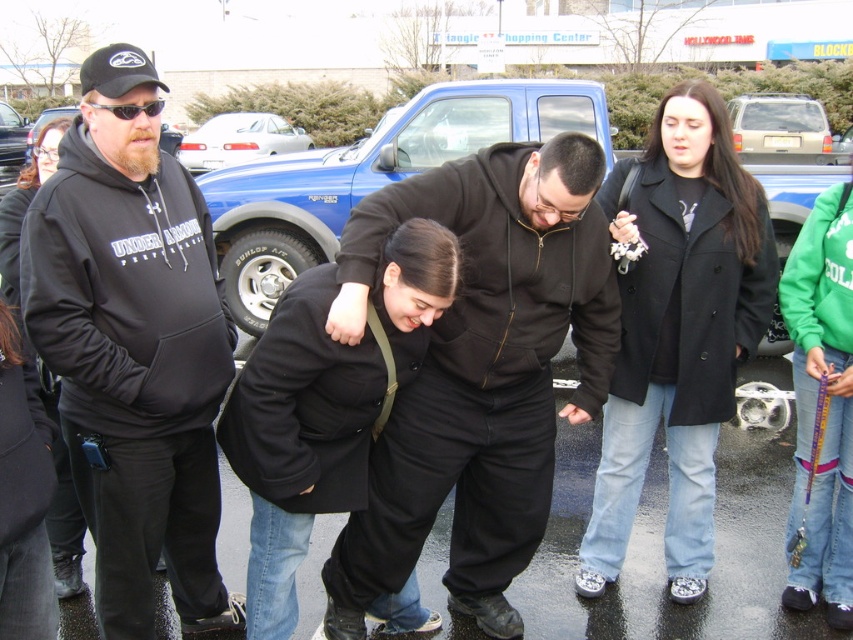
Question: Which is farther from the black matte coat at center?

Choices:
 (A) black matte hoodie at center
 (B) black wool coat at center
 (C) brushed metal truck at left
 (D) matte black coat at center

Answer: (C)

Question: Can you confirm if black hoodie at left is positioned above brushed metal truck at left?

Choices:
 (A) no
 (B) yes

Answer: (A)

Question: Among these objects, which one is farthest from the camera?

Choices:
 (A) black matte hoodie at center
 (B) brushed metal truck at left
 (C) black wool coat at center

Answer: (B)

Question: Is green fleece sweatshirt at lower right smaller than brushed metal truck at left?

Choices:
 (A) no
 (B) yes

Answer: (B)

Question: Estimate the real-world distances between objects in this image. Which object is farther from the satin silver sedan at upper left?

Choices:
 (A) green fleece sweatshirt at lower right
 (B) black wool coat at center
 (C) gold metallic suv at upper right
 (D) black matte coat at center

Answer: (A)

Question: Is black wool coat at center bigger than black matte coat at center?

Choices:
 (A) no
 (B) yes

Answer: (B)